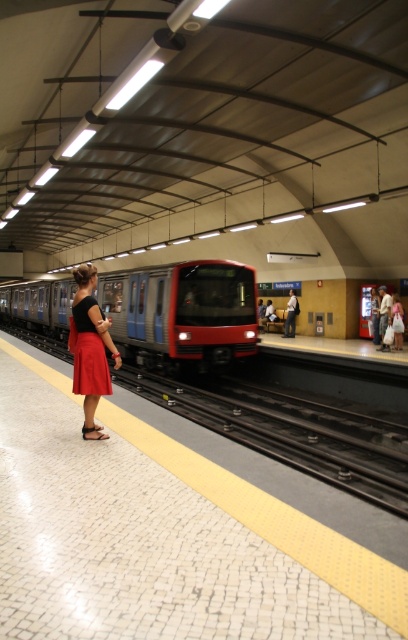
Is matte red train at center bigger than matte red skirt at left?

Indeed, matte red train at center has a larger size compared to matte red skirt at left.

Is the position of matte red train at center less distant than that of matte red skirt at left?

That is False.

Is point (117, 314) farther from camera compared to point (90, 380)?

Yes, it is.

You are a GUI agent. You are given a task and a screenshot of the screen. Output one action in this format:
    pyautogui.click(x=<x>, y=<y>)
    Task: Click on the matte red train at center
    The width and height of the screenshot is (408, 640).
    Given the screenshot: What is the action you would take?
    pyautogui.click(x=181, y=314)

You are a GUI agent. You are given a task and a screenshot of the screen. Output one action in this format:
    pyautogui.click(x=<x>, y=<y>)
    Task: Click on the white mosaic tile platform at center
    
    Given the screenshot: What is the action you would take?
    pyautogui.click(x=161, y=536)

Is point (155, 593) positioned before point (93, 429)?

Yes, it is.

Locate an element on the screen. white mosaic tile platform at center is located at coordinates (161, 536).

Which is above, white mosaic tile platform at center or matte red skirt at left?

matte red skirt at left is above.

Which is more to the right, white mosaic tile platform at center or matte red skirt at left?

matte red skirt at left

Is point (261, 580) positioned behind point (73, 356)?

No, (261, 580) is in front of (73, 356).

Identify the location of white mosaic tile platform at center. The height and width of the screenshot is (640, 408). (161, 536).